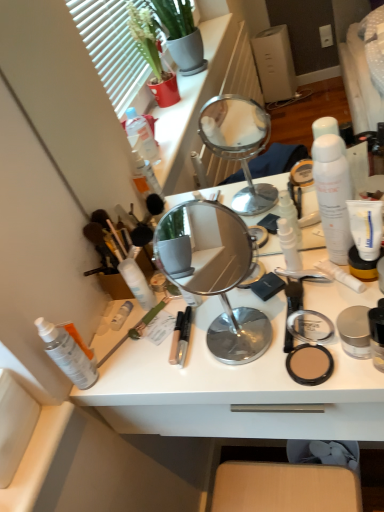
The image size is (384, 512). In order to click on free spot to the left of white matte tube at right, acting as the first toothpaste starting from the top in this screenshot , I will do `click(272, 314)`.